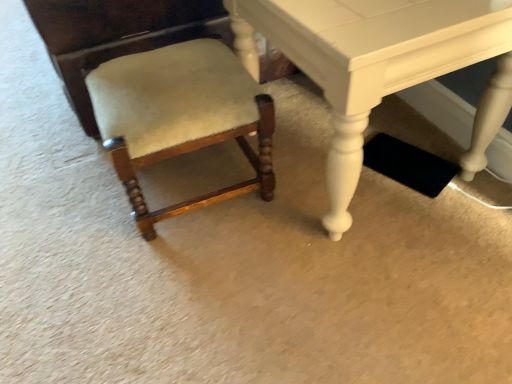
Question: Is matte white table at center wider or thinner than suede-like beige chair at lower left?

Choices:
 (A) wide
 (B) thin

Answer: (A)

Question: Is matte white table at center taller or shorter than suede-like beige chair at lower left?

Choices:
 (A) tall
 (B) short

Answer: (A)

Question: From a real-world perspective, is matte white table at center positioned above or below suede-like beige chair at lower left?

Choices:
 (A) below
 (B) above

Answer: (B)

Question: Visually, is suede-like beige chair at lower left positioned to the left or to the right of matte white table at center?

Choices:
 (A) right
 (B) left

Answer: (B)

Question: Is suede-like beige chair at lower left in front of or behind matte white table at center in the image?

Choices:
 (A) front
 (B) behind

Answer: (B)

Question: From the image's perspective, is suede-like beige chair at lower left located above or below matte white table at center?

Choices:
 (A) above
 (B) below

Answer: (B)

Question: Is point (226, 71) closer or farther from the camera than point (343, 140)?

Choices:
 (A) closer
 (B) farther

Answer: (B)